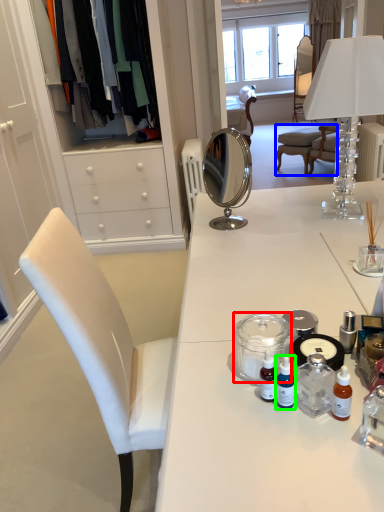
Question: Based on their relative distances, which object is nearer to glass jar (highlighted by a red box)? Choose from chair (highlighted by a blue box) and toiletry (highlighted by a green box).

Choices:
 (A) chair
 (B) toiletry

Answer: (B)